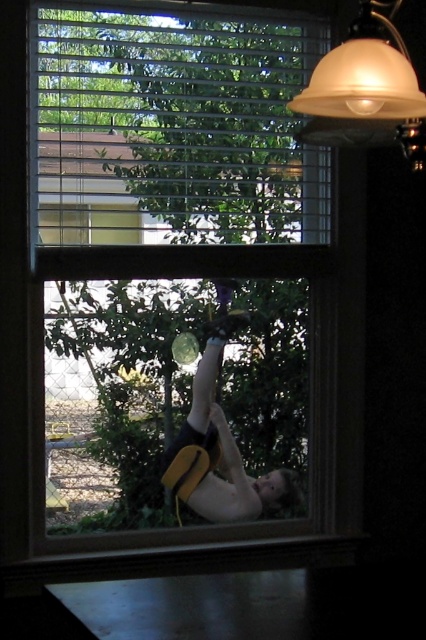
Question: Can you confirm if matte white dome at upper right is positioned below yellow fabric backpack at center?

Choices:
 (A) yes
 (B) no

Answer: (B)

Question: Does green wood blinds at upper center come behind yellow fabric backpack at center?

Choices:
 (A) no
 (B) yes

Answer: (A)

Question: Estimate the real-world distances between objects in this image. Which object is farther from the green wood blinds at upper center?

Choices:
 (A) matte white dome at upper right
 (B) yellow fabric backpack at center

Answer: (B)

Question: Which point is closer to the camera?

Choices:
 (A) (385, 93)
 (B) (166, 451)

Answer: (A)

Question: Which point is closer to the camera?

Choices:
 (A) yellow fabric backpack at center
 (B) green wood blinds at upper center
 (C) matte white dome at upper right

Answer: (C)

Question: Does green wood blinds at upper center have a larger size compared to yellow fabric backpack at center?

Choices:
 (A) yes
 (B) no

Answer: (A)